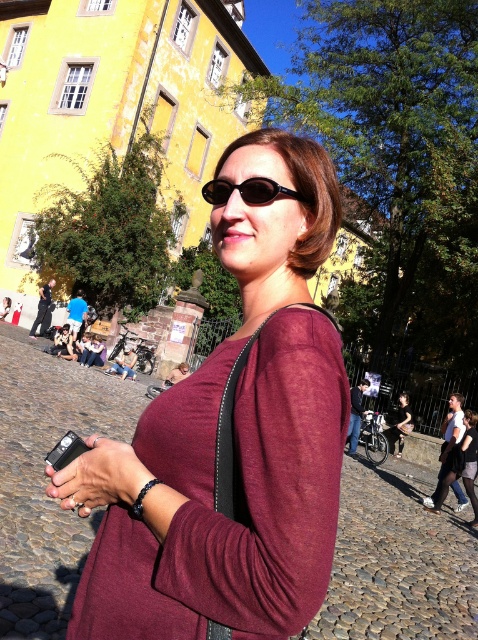
Does point (470, 417) come closer to viewer compared to point (403, 412)?

Yes, point (470, 417) is in front of point (403, 412).

Can you confirm if matte black jacket at center is positioned below black leather pants at lower right?

No, matte black jacket at center is not below black leather pants at lower right.

Does point (468, 488) come farther from viewer compared to point (401, 406)?

No, it is not.

You are a GUI agent. You are given a task and a screenshot of the screen. Output one action in this format:
    pyautogui.click(x=<x>, y=<y>)
    Task: Click on the matte black jacket at center
    This screenshot has width=478, height=640.
    Given the screenshot: What is the action you would take?
    pyautogui.click(x=469, y=460)

Can you confirm if black plastic sunglasses at center is wider than black leather pants at lower right?

Incorrect, black plastic sunglasses at center's width does not surpass black leather pants at lower right's.

Does black plastic sunglasses at center appear on the right side of black leather pants at lower right?

No, black plastic sunglasses at center is not to the right of black leather pants at lower right.

This screenshot has height=640, width=478. What do you see at coordinates (248, 192) in the screenshot?
I see `black plastic sunglasses at center` at bounding box center [248, 192].

Locate an element on the screen. Image resolution: width=478 pixels, height=640 pixels. black plastic sunglasses at center is located at coordinates (248, 192).

Between matte black phone at center and matte black jacket at center, which one is positioned lower?

matte black jacket at center

Where is `matte black phone at center`? This screenshot has width=478, height=640. matte black phone at center is located at coordinates (98, 476).